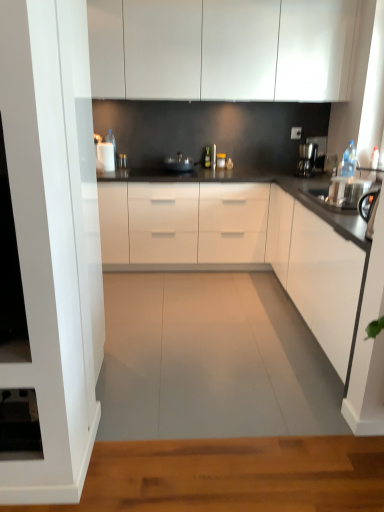
Measure the distance between metallic silver pan at center and camera.

metallic silver pan at center and camera are 12.78 feet apart.

How much space does white glossy cabinets at upper center, the first cabinetry in the top-to-bottom sequence, occupy vertically?

It is 34.64 inches.

Measure the distance between point (292, 182) and camera.

A distance of 11.73 feet exists between point (292, 182) and camera.

Measure the distance between sleek black coffee machine at right and camera.

A distance of 3.93 meters exists between sleek black coffee machine at right and camera.

This screenshot has height=512, width=384. Identify the location of white glossy cabinet at right, which ranks as the second cabinetry in top-to-bottom order. (325, 283).

Between white glossy cabinet at right, which ranks as the second cabinetry in top-to-bottom order, and black glossy countertop at center, positioned as the second countertop in back-to-front order, which one has more height?

With more height is black glossy countertop at center, positioned as the second countertop in back-to-front order.

Choose the correct answer: Is white glossy cabinet at right, which ranks as the second cabinetry in top-to-bottom order, inside black glossy countertop at center, the 1th countertop in the front-to-back sequence, or outside it?

white glossy cabinet at right, which ranks as the second cabinetry in top-to-bottom order, is inside black glossy countertop at center, the 1th countertop in the front-to-back sequence.

From the picture: From a real-world perspective, which object rests below the other?

black glossy countertop at center, the 1th countertop in the front-to-back sequence.

What are the coordinates of `countertop in front of the white glossy cabinet at right, which ranks as the second cabinetry in top-to-bottom order` in the screenshot? It's located at (252, 248).

Which of these two, black glossy countertop at center, positioned as the second countertop in back-to-front order, or metallic silver pan at center, is wider?

black glossy countertop at center, positioned as the second countertop in back-to-front order.

Is black glossy countertop at center, positioned as the second countertop in back-to-front order, situated inside metallic silver pan at center or outside?

black glossy countertop at center, positioned as the second countertop in back-to-front order, exists outside the volume of metallic silver pan at center.

Can you see black glossy countertop at center, the 1th countertop in the front-to-back sequence, touching metallic silver pan at center?

They are not placed beside each other.

Is black glossy countertop at center, the 1th countertop in the front-to-back sequence, bigger or smaller than metallic silver pan at center?

black glossy countertop at center, the 1th countertop in the front-to-back sequence, is bigger than metallic silver pan at center.

Identify the location of the 2nd cabinetry positioned above the white glossy countertop at center, which is the second countertop in front-to-back order (from a real-world perspective). This screenshot has height=512, width=384. (221, 49).

From the image's perspective, relative to white glossy cabinets at upper center, the first cabinetry in the top-to-bottom sequence, is white glossy countertop at center, the first countertop in the back-to-front sequence, above or below?

Based on their image positions, white glossy countertop at center, the first countertop in the back-to-front sequence, is located beneath white glossy cabinets at upper center, the first cabinetry in the top-to-bottom sequence.

Looking at this image, does white glossy countertop at center, the first countertop in the back-to-front sequence, appear on the right side of white glossy cabinets at upper center, placed as the 2th cabinetry when sorted from bottom to top?

No, white glossy countertop at center, the first countertop in the back-to-front sequence, is not to the right of white glossy cabinets at upper center, placed as the 2th cabinetry when sorted from bottom to top.

Consider the image. Is white glossy countertop at center, which is the second countertop in front-to-back order, wider or thinner than white glossy cabinets at upper center, the first cabinetry in the top-to-bottom sequence?

In the image, white glossy countertop at center, which is the second countertop in front-to-back order, appears to be wider than white glossy cabinets at upper center, the first cabinetry in the top-to-bottom sequence.

Where is `countertop located behind the white glossy cabinet at right, the 1th cabinetry ordered from the bottom`? countertop located behind the white glossy cabinet at right, the 1th cabinetry ordered from the bottom is located at coordinates (263, 182).

Does white glossy countertop at center, the first countertop in the back-to-front sequence, appear on the left side of white glossy cabinet at right, the 1th cabinetry ordered from the bottom?

Yes, white glossy countertop at center, the first countertop in the back-to-front sequence, is to the left of white glossy cabinet at right, the 1th cabinetry ordered from the bottom.

Which object is wider, white glossy countertop at center, which is the second countertop in front-to-back order, or white glossy cabinet at right, the 1th cabinetry ordered from the bottom?

white glossy countertop at center, which is the second countertop in front-to-back order, is wider.

What's the angular difference between white glossy countertop at center, which is the second countertop in front-to-back order, and white glossy cabinet at right, which ranks as the second cabinetry in top-to-bottom order,'s facing directions?

white glossy countertop at center, which is the second countertop in front-to-back order, and white glossy cabinet at right, which ranks as the second cabinetry in top-to-bottom order, are facing 90 degrees away from each other.

How much distance is there between metallic silver pan at center and white glossy cabinet at right, the 1th cabinetry ordered from the bottom?

metallic silver pan at center is 1.86 meters away from white glossy cabinet at right, the 1th cabinetry ordered from the bottom.

Which object is positioned more to the right, metallic silver pan at center or white glossy cabinet at right, which ranks as the second cabinetry in top-to-bottom order?

white glossy cabinet at right, which ranks as the second cabinetry in top-to-bottom order.

Find the location of a particular element. This screenshot has width=384, height=512. appliance that is behind the white glossy cabinet at right, the 1th cabinetry ordered from the bottom is located at coordinates (179, 163).

From a real-world perspective, who is located lower, metallic silver pan at center or white glossy cabinet at right, which ranks as the second cabinetry in top-to-bottom order?

In real-world perspective, white glossy cabinet at right, which ranks as the second cabinetry in top-to-bottom order, is lower.

Is white glossy cabinets at upper center, the first cabinetry in the top-to-bottom sequence, positioned beyond the bounds of sleek black coffee machine at right?

white glossy cabinets at upper center, the first cabinetry in the top-to-bottom sequence, lies outside sleek black coffee machine at right's area.

From the image's perspective, relative to sleek black coffee machine at right, is white glossy cabinets at upper center, placed as the 2th cabinetry when sorted from bottom to top, above or below?

white glossy cabinets at upper center, placed as the 2th cabinetry when sorted from bottom to top, is above sleek black coffee machine at right.

Between white glossy cabinets at upper center, the first cabinetry in the top-to-bottom sequence, and sleek black coffee machine at right, which one has smaller width?

With smaller width is sleek black coffee machine at right.

Considering the relative sizes of white glossy cabinets at upper center, placed as the 2th cabinetry when sorted from bottom to top, and sleek black coffee machine at right in the image provided, is white glossy cabinets at upper center, placed as the 2th cabinetry when sorted from bottom to top, shorter than sleek black coffee machine at right?

In fact, white glossy cabinets at upper center, placed as the 2th cabinetry when sorted from bottom to top, may be taller than sleek black coffee machine at right.

Is black glossy countertop at center, the 1th countertop in the front-to-back sequence, facing away from sleek black coffee machine at right?

black glossy countertop at center, the 1th countertop in the front-to-back sequence, does not have its back to sleek black coffee machine at right.

Considering the relative sizes of black glossy countertop at center, the 1th countertop in the front-to-back sequence, and sleek black coffee machine at right in the image provided, is black glossy countertop at center, the 1th countertop in the front-to-back sequence, bigger than sleek black coffee machine at right?

Yes, black glossy countertop at center, the 1th countertop in the front-to-back sequence, is bigger than sleek black coffee machine at right.

The height and width of the screenshot is (512, 384). What are the coordinates of `coffee machine above the black glossy countertop at center, the 1th countertop in the front-to-back sequence (from the image's perspective)` in the screenshot? It's located at (307, 159).

This screenshot has width=384, height=512. What are the coordinates of `the 1st countertop directly beneath the white glossy cabinet at right, the 1th cabinetry ordered from the bottom (from a real-world perspective)` in the screenshot? It's located at (252, 248).

You are a GUI agent. You are given a task and a screenshot of the screen. Output one action in this format:
    pyautogui.click(x=<x>, y=<y>)
    Task: Click on the appliance above the black glossy countertop at center, the 1th countertop in the front-to-back sequence (from a real-world perspective)
    This screenshot has width=384, height=512.
    Given the screenshot: What is the action you would take?
    pyautogui.click(x=179, y=163)

Estimate the real-world distances between objects in this image. Which object is closer to sleek black coffee machine at right, black glossy countertop at center, positioned as the second countertop in back-to-front order, or metallic silver pan at center?

Among the two, metallic silver pan at center is located nearer to sleek black coffee machine at right.

When comparing their distances from sleek black coffee machine at right, does black glossy countertop at center, the 1th countertop in the front-to-back sequence, or white glossy countertop at center, the first countertop in the back-to-front sequence, seem further?

The object further to sleek black coffee machine at right is black glossy countertop at center, the 1th countertop in the front-to-back sequence.

From the picture: From the image, which object appears to be nearer to metallic silver pan at center, white glossy countertop at center, which is the second countertop in front-to-back order, or white glossy cabinets at upper center, placed as the 2th cabinetry when sorted from bottom to top?

The object closer to metallic silver pan at center is white glossy countertop at center, which is the second countertop in front-to-back order.

Based on their spatial positions, is black glossy countertop at center, positioned as the second countertop in back-to-front order, or white glossy countertop at center, the first countertop in the back-to-front sequence, closer to white glossy cabinet at right, which ranks as the second cabinetry in top-to-bottom order?

The object closer to white glossy cabinet at right, which ranks as the second cabinetry in top-to-bottom order, is black glossy countertop at center, positioned as the second countertop in back-to-front order.

Which object lies further to the anchor point black glossy countertop at center, the 1th countertop in the front-to-back sequence, white glossy cabinet at right, the 1th cabinetry ordered from the bottom, or sleek black coffee machine at right?

The object further to black glossy countertop at center, the 1th countertop in the front-to-back sequence, is sleek black coffee machine at right.

When comparing their distances from white glossy cabinets at upper center, placed as the 2th cabinetry when sorted from bottom to top, does white glossy countertop at center, which is the second countertop in front-to-back order, or black glossy countertop at center, positioned as the second countertop in back-to-front order, seem further?

Among the two, black glossy countertop at center, positioned as the second countertop in back-to-front order, is located further to white glossy cabinets at upper center, placed as the 2th cabinetry when sorted from bottom to top.

Considering their positions, is sleek black coffee machine at right positioned further to black glossy countertop at center, positioned as the second countertop in back-to-front order, than white glossy cabinet at right, which ranks as the second cabinetry in top-to-bottom order?

sleek black coffee machine at right lies further to black glossy countertop at center, positioned as the second countertop in back-to-front order, than the other object.

Estimate the real-world distances between objects in this image. Which object is further from metallic silver pan at center, black glossy countertop at center, the 1th countertop in the front-to-back sequence, or white glossy cabinets at upper center, placed as the 2th cabinetry when sorted from bottom to top?

The object further to metallic silver pan at center is black glossy countertop at center, the 1th countertop in the front-to-back sequence.

Locate an element on the screen. The width and height of the screenshot is (384, 512). coffee machine between white glossy cabinets at upper center, placed as the 2th cabinetry when sorted from bottom to top, and white glossy cabinet at right, the 1th cabinetry ordered from the bottom, in the up-down direction is located at coordinates (307, 159).

Locate an element on the screen. This screenshot has height=512, width=384. coffee machine positioned between white glossy cabinet at right, which ranks as the second cabinetry in top-to-bottom order, and white glossy countertop at center, which is the second countertop in front-to-back order, from near to far is located at coordinates pos(307,159).

You are a GUI agent. You are given a task and a screenshot of the screen. Output one action in this format:
    pyautogui.click(x=<x>, y=<y>)
    Task: Click on the coffee machine between black glossy countertop at center, positioned as the second countertop in back-to-front order, and white glossy countertop at center, which is the second countertop in front-to-back order, along the z-axis
    The height and width of the screenshot is (512, 384).
    Given the screenshot: What is the action you would take?
    pyautogui.click(x=307, y=159)

You are a GUI agent. You are given a task and a screenshot of the screen. Output one action in this format:
    pyautogui.click(x=<x>, y=<y>)
    Task: Click on the coffee machine between white glossy cabinets at upper center, the first cabinetry in the top-to-bottom sequence, and white glossy countertop at center, the first countertop in the back-to-front sequence, in the vertical direction
    This screenshot has height=512, width=384.
    Given the screenshot: What is the action you would take?
    pyautogui.click(x=307, y=159)